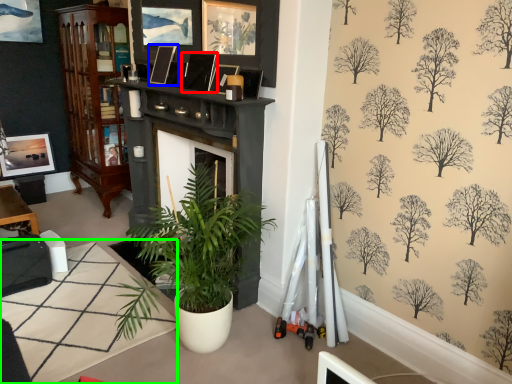
Question: Based on their relative distances, which object is nearer to picture frame (highlighted by a red box)? Choose from picture frame (highlighted by a blue box) and table (highlighted by a green box).

Choices:
 (A) picture frame
 (B) table

Answer: (A)